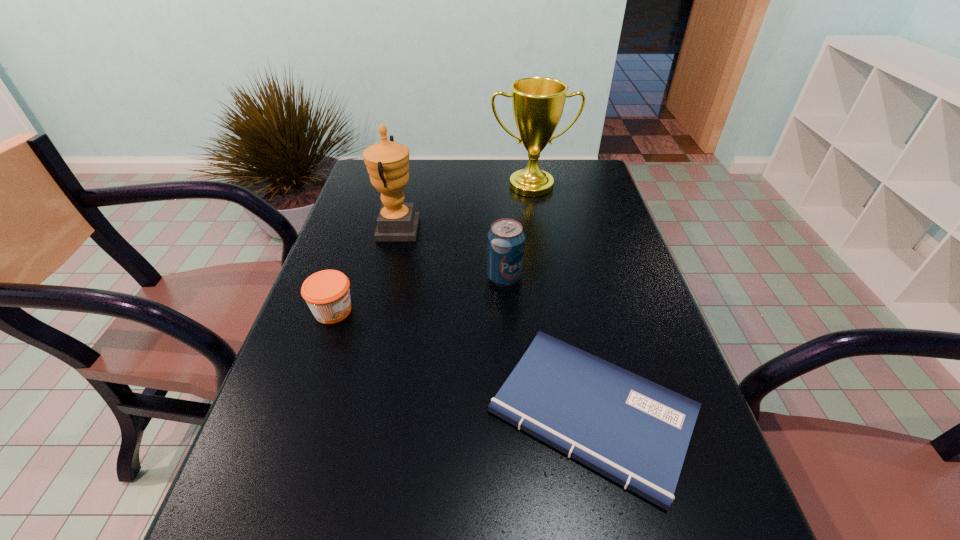
At what (x,y) coordinates should I click in order to perform the action: click on vacant space located by the handles of the right award. Please return your answer as a coordinate pair (x, y). Looking at the image, I should click on (539, 232).

Where is `free space located at the front of the left award with handles`? Image resolution: width=960 pixels, height=540 pixels. free space located at the front of the left award with handles is located at coordinates (520, 230).

This screenshot has height=540, width=960. What are the coordinates of `vacant area situated 0.080m on the left of the third farthest object` in the screenshot? It's located at (455, 277).

Locate an element on the screen. The image size is (960, 540). vacant region located 0.340m on the front label of the fourth farthest object is located at coordinates (504, 311).

The height and width of the screenshot is (540, 960). In order to click on vacant point located 0.270m on the back of the nearest object in this screenshot , I will do `click(560, 260)`.

Locate an element on the screen. The image size is (960, 540). object that is at the far edge is located at coordinates (537, 102).

Locate an element on the screen. This screenshot has height=540, width=960. award situated at the left edge is located at coordinates (387, 162).

I want to click on jam present at the left edge, so click(327, 293).

The width and height of the screenshot is (960, 540). What are the coordinates of `award that is at the right edge` in the screenshot? It's located at (x=537, y=102).

Locate an element on the screen. paperback book present at the right edge is located at coordinates (636, 432).